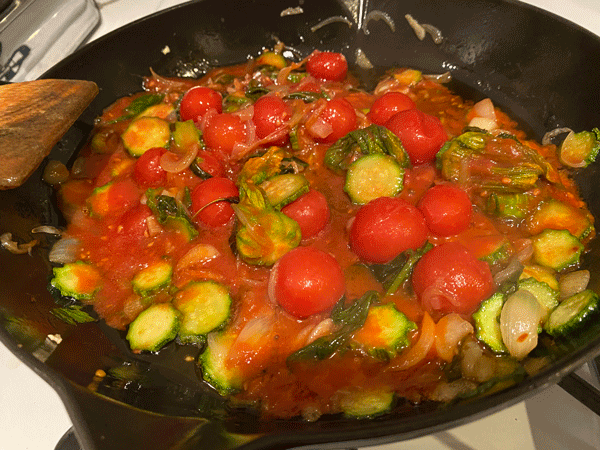
Image resolution: width=600 pixels, height=450 pixels. Identify the location of frying pan. (128, 414), (374, 436).